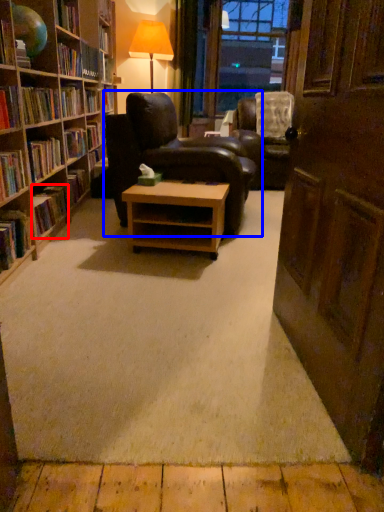
Question: Which object appears closest to the camera in this image, book (highlighted by a red box) or chair (highlighted by a blue box)?

Choices:
 (A) book
 (B) chair

Answer: (A)